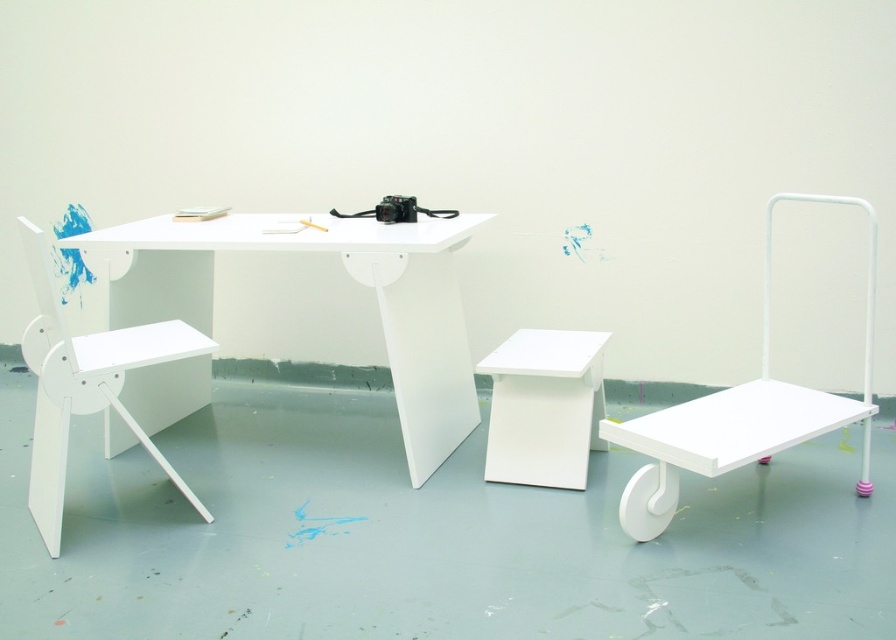
You are setting up a video call and need to place your camera closer to the white matte table at center. Currently, the camera is 6.34 feet away from the table. If your video call requires the camera to be within 5 feet of the table for optimal performance, is the current distance acceptable?

The camera is currently 6.34 feet away from the white matte table at center, which exceeds the recommended 5 feet for optimal performance. Therefore, the camera needs to be moved closer to ensure better quality during the video call.

You are setting up a small workspace and need to place both the white matte table at center and the white matte stool at center. Since space is limited, which object should you prioritize keeping in the center to ensure there is enough room for both?

The white matte table at center is bigger than the white matte stool at center, so you should prioritize keeping the white matte table at center in the center to accommodate its larger size, allowing space for the smaller stool nearby.

You are a person who is 36 inches tall and wants to sit on either the white matte chair at left or the white matte stool at center. Which one is closer to you?

The white matte stool at center is closer to you since it is only 36.73 inches away from the chair, but since you are 36 inches tall, the distance between the two objects is not directly related to your height. The question might need clarification on your position relative to the objects.